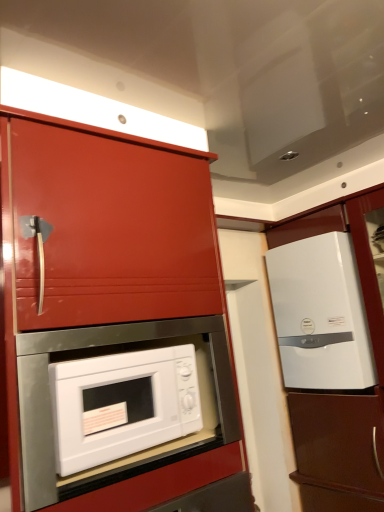
Question: From a real-world perspective, is white glossy cabinet at right, the 1th cabinetry from the back, below white glossy microwave at center?

Choices:
 (A) no
 (B) yes

Answer: (B)

Question: Is white glossy cabinet at right, the second cabinetry viewed from the left, taller than white glossy microwave at center?

Choices:
 (A) yes
 (B) no

Answer: (A)

Question: Does white glossy cabinet at right, which is counted as the 2th cabinetry, starting from the front, appear on the right side of white glossy microwave at center?

Choices:
 (A) no
 (B) yes

Answer: (B)

Question: Does white glossy cabinet at right, the second cabinetry viewed from the left, have a lesser height compared to white glossy microwave at center?

Choices:
 (A) yes
 (B) no

Answer: (B)

Question: Can you confirm if white glossy cabinet at right, marked as the 1th cabinetry in a right-to-left arrangement, is bigger than white glossy microwave at center?

Choices:
 (A) yes
 (B) no

Answer: (A)

Question: From a real-world perspective, is white glossy cabinet at right, which is counted as the 2th cabinetry, starting from the front, positioned over white glossy microwave at center based on gravity?

Choices:
 (A) yes
 (B) no

Answer: (B)

Question: Is white glossy refrigerator at right at the right side of white glossy microwave at center?

Choices:
 (A) yes
 (B) no

Answer: (A)

Question: Can you confirm if white glossy refrigerator at right is taller than white glossy microwave at center?

Choices:
 (A) yes
 (B) no

Answer: (A)

Question: From a real-world perspective, is white glossy refrigerator at right below white glossy microwave at center?

Choices:
 (A) yes
 (B) no

Answer: (B)

Question: From the image's perspective, is white glossy refrigerator at right on white glossy microwave at center?

Choices:
 (A) no
 (B) yes

Answer: (B)

Question: Is white glossy refrigerator at right wider than white glossy microwave at center?

Choices:
 (A) no
 (B) yes

Answer: (B)

Question: Can white glossy microwave at center be found inside white glossy refrigerator at right?

Choices:
 (A) yes
 (B) no

Answer: (B)

Question: From a real-world perspective, is white glossy cabinet at right, the second cabinetry viewed from the left, positioned over glossy red cabinet at center, the 1th cabinetry when ordered from front to back, based on gravity?

Choices:
 (A) no
 (B) yes

Answer: (A)